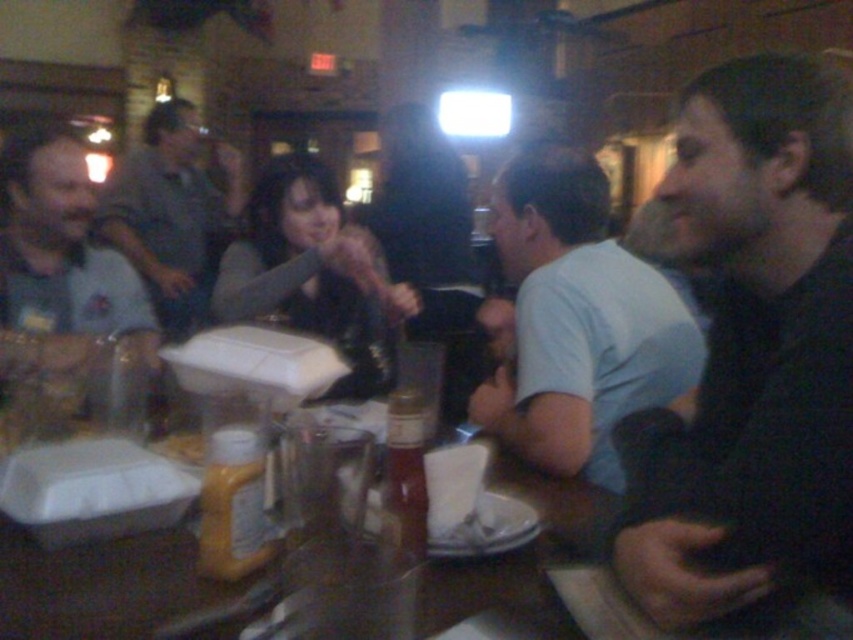
Question: Considering the real-world distances, which object is farthest from the black matte jacket at right?

Choices:
 (A) translucent plastic bottle at center
 (B) yellow matte plastic container at lower left

Answer: (B)

Question: Can you confirm if black matte jacket at right is positioned below light blue t-shirt at center?

Choices:
 (A) no
 (B) yes

Answer: (B)

Question: Can you confirm if matte gray shirt at left is positioned to the right of gray shirt at upper left?

Choices:
 (A) no
 (B) yes

Answer: (B)

Question: Which is farther from the black matte jacket at right?

Choices:
 (A) wooden table at center
 (B) matte gray shirt at left
 (C) yellow matte plastic container at lower left

Answer: (B)

Question: Which object appears closest to the camera in this image?

Choices:
 (A) light blue t-shirt at center
 (B) wooden table at center
 (C) gray shirt at upper left
 (D) yellow plastic mustard bottle at center

Answer: (B)

Question: Does light blue t-shirt at center have a lesser width compared to matte gray shirt at left?

Choices:
 (A) yes
 (B) no

Answer: (A)